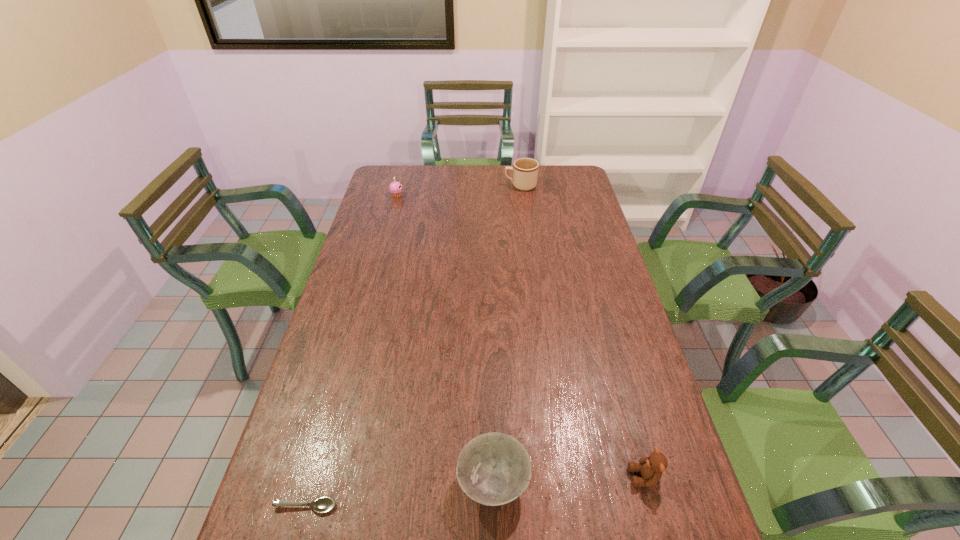
In order to click on mug in this screenshot , I will do `click(525, 170)`.

Image resolution: width=960 pixels, height=540 pixels. I want to click on the rightmost object, so click(651, 468).

I want to click on cupcake, so click(395, 188).

Where is `bowl`? The height and width of the screenshot is (540, 960). bowl is located at coordinates (493, 469).

You are a GUI agent. You are given a task and a screenshot of the screen. Output one action in this format:
    pyautogui.click(x=<x>, y=<y>)
    Task: Click on the shortest object
    The height and width of the screenshot is (540, 960).
    Given the screenshot: What is the action you would take?
    pyautogui.click(x=322, y=505)

This screenshot has height=540, width=960. I want to click on vacant space located on the side of the mug with the handle, so click(x=427, y=186).

This screenshot has height=540, width=960. I want to click on vacant space located on the side of the mug with the handle, so click(441, 186).

This screenshot has height=540, width=960. I want to click on vacant space located on the side of the mug with the handle, so click(x=444, y=186).

Locate an element on the screen. vacant space situated on the face of the rightmost object is located at coordinates (479, 477).

Find the location of a particular element. The width and height of the screenshot is (960, 540). free spot located on the face of the rightmost object is located at coordinates (576, 477).